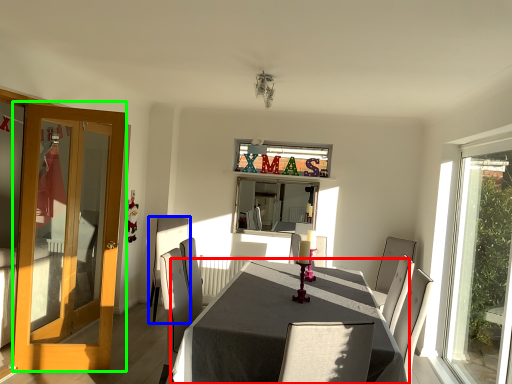
Question: Considering the real-world distances, which object is farthest from table (highlighted by a red box)? chair (highlighted by a blue box) or door (highlighted by a green box)?

Choices:
 (A) chair
 (B) door

Answer: (A)